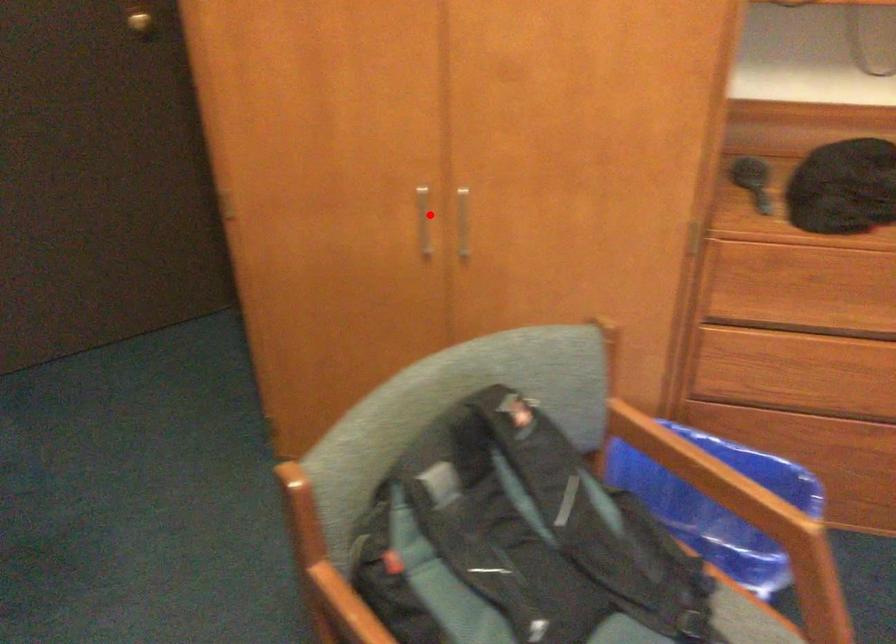
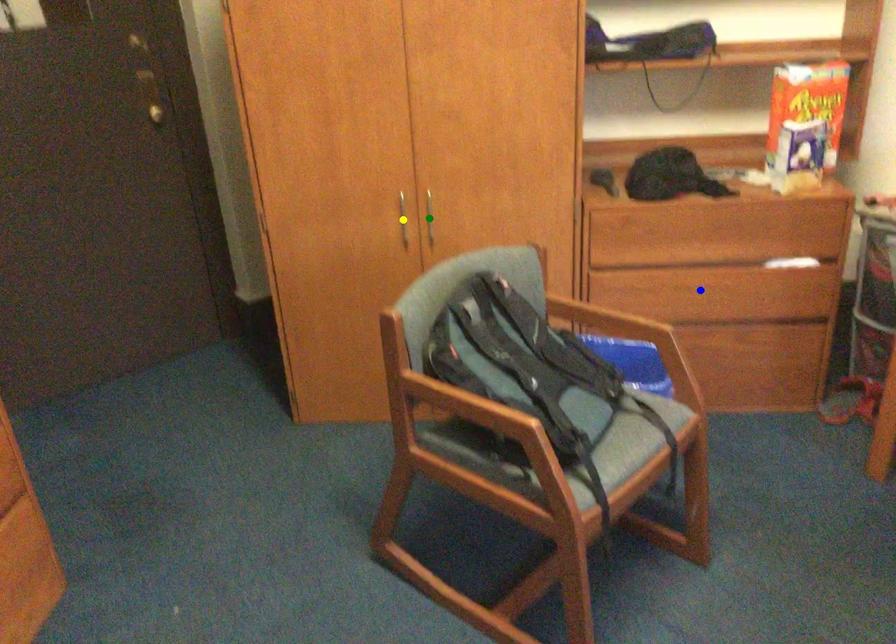
Question: I am providing you with two images of the same scene from different viewpoints. A red point is marked on the first image. You are given multiple points on the second image. Which spot in image 2 lines up with the point in image 1?

Choices:
 (A) green point
 (B) blue point
 (C) yellow point

Answer: (C)